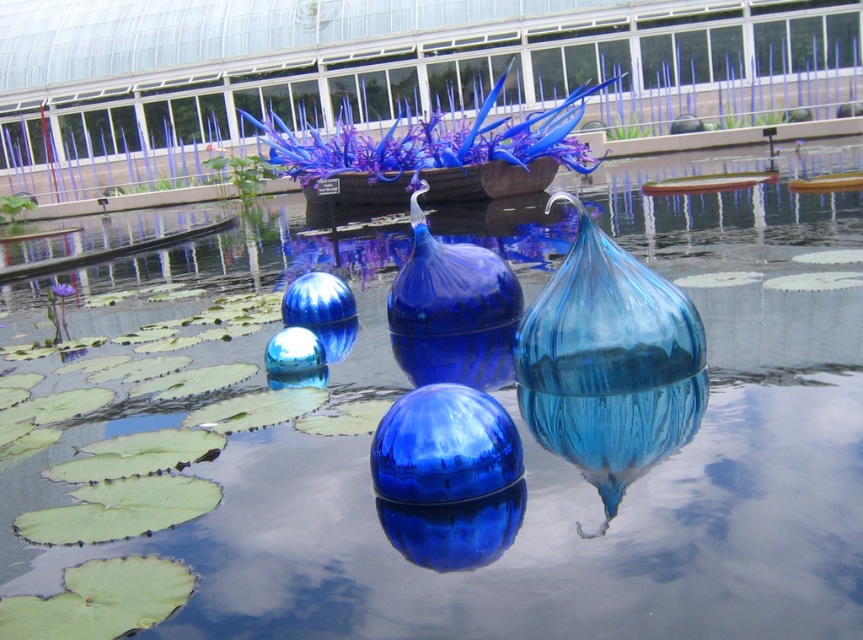
Can you confirm if blue glass vase at center is bigger than glossy blue glass vase at center?

Incorrect, blue glass vase at center is not larger than glossy blue glass vase at center.

Can you confirm if blue glass vase at center is positioned to the right of glossy blue glass vase at center?

Indeed, blue glass vase at center is positioned on the right side of glossy blue glass vase at center.

Does point (596, 333) lie behind point (416, 234)?

No, (596, 333) is closer to viewer.

What are the coordinates of `blue glass vase at center` in the screenshot? It's located at (605, 323).